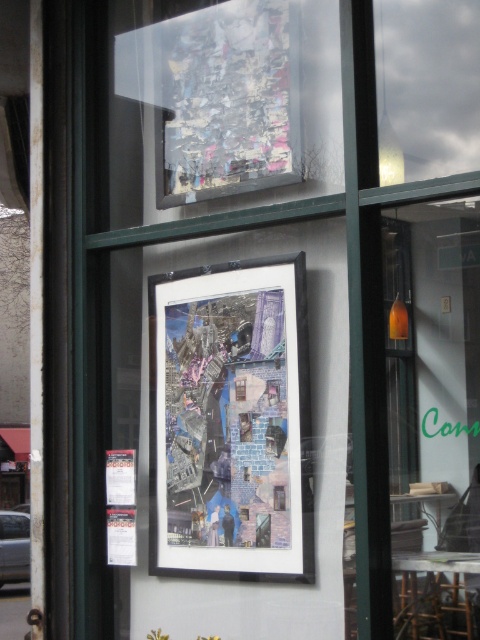
You are a delivery person who needs to place a new artwork between the matte black collage at center and the metallic collage at upper center. Given that the new artwork is 1.2 meters wide, can it fit in the space between them without overlapping?

The matte black collage at center is larger than the metallic collage at upper center. However, the exact distance between them isn not specified in the provided description. Therefore, it is uncertain whether the 1.2 meter wide artwork can fit without overlapping.